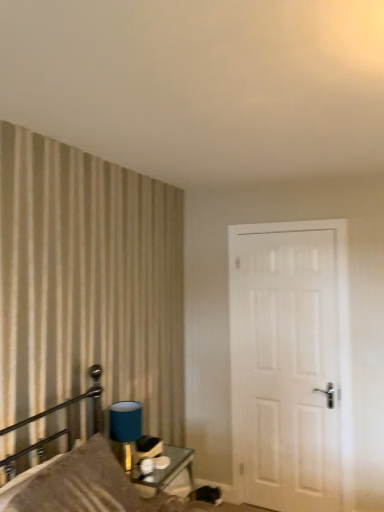
Question: Is satin brown pillow at left touching metallic glass table at lower center?

Choices:
 (A) no
 (B) yes

Answer: (A)

Question: Is satin brown pillow at left taller than metallic glass table at lower center?

Choices:
 (A) no
 (B) yes

Answer: (B)

Question: From a real-world perspective, is satin brown pillow at left on metallic glass table at lower center?

Choices:
 (A) no
 (B) yes

Answer: (B)

Question: From the image's perspective, does satin brown pillow at left appear lower than metallic glass table at lower center?

Choices:
 (A) yes
 (B) no

Answer: (B)

Question: From a real-world perspective, is satin brown pillow at left physically below metallic glass table at lower center?

Choices:
 (A) yes
 (B) no

Answer: (B)

Question: Is metallic glass table at lower center to the left or to the right of textured beige pillow at left in the image?

Choices:
 (A) right
 (B) left

Answer: (A)

Question: Which is correct: metallic glass table at lower center is inside textured beige pillow at left, or outside of it?

Choices:
 (A) outside
 (B) inside

Answer: (A)

Question: Is metallic glass table at lower center wider or thinner than textured beige pillow at left?

Choices:
 (A) thin
 (B) wide

Answer: (B)

Question: From a real-world perspective, relative to textured beige pillow at left, is metallic glass table at lower center vertically above or below?

Choices:
 (A) above
 (B) below

Answer: (B)

Question: Considering the positions of satin brown pillow at left and white matte door at right in the image, is satin brown pillow at left bigger or smaller than white matte door at right?

Choices:
 (A) small
 (B) big

Answer: (B)

Question: From a real-world perspective, is satin brown pillow at left positioned above or below white matte door at right?

Choices:
 (A) below
 (B) above

Answer: (A)

Question: Considering the positions of satin brown pillow at left and white matte door at right in the image, is satin brown pillow at left taller or shorter than white matte door at right?

Choices:
 (A) short
 (B) tall

Answer: (A)

Question: Is satin brown pillow at left to the left or to the right of white matte door at right in the image?

Choices:
 (A) right
 (B) left

Answer: (B)

Question: Relative to blue fabric lampshade at upper left, is white matte door at right in front or behind?

Choices:
 (A) behind
 (B) front

Answer: (A)

Question: From a real-world perspective, relative to blue fabric lampshade at upper left, is white matte door at right vertically above or below?

Choices:
 (A) above
 (B) below

Answer: (A)